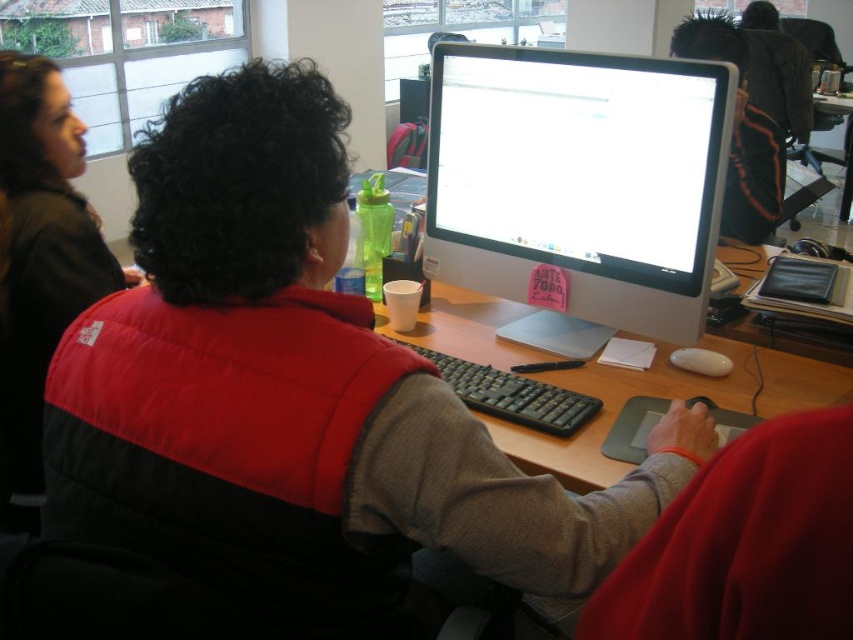
You are organizing the desk and need to place a new laptop between the white glossy computer monitor at center and the wooden desk at center. Is this possible?

The white glossy computer monitor at center is positioned over the wooden desk at center, so there is no space between them to place a new laptop.